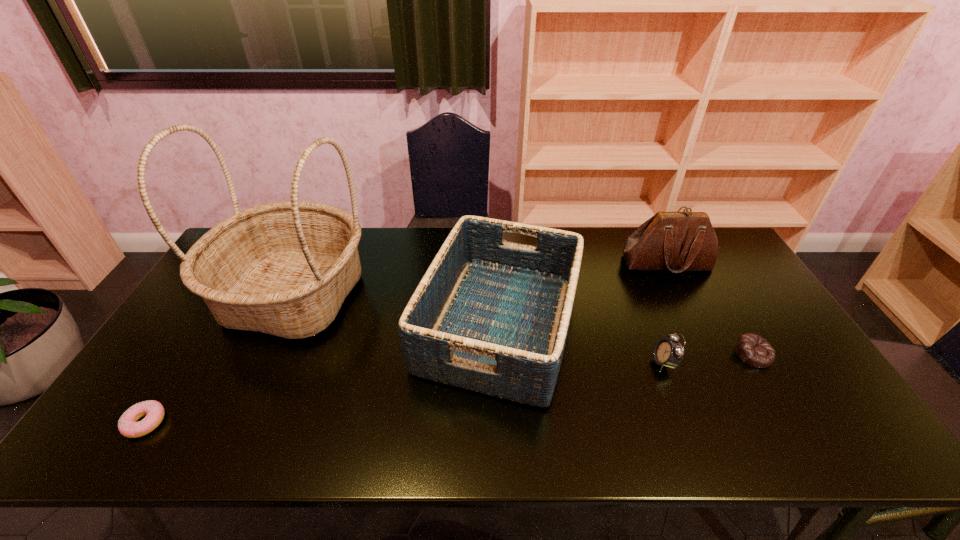
This screenshot has height=540, width=960. Find the location of `the taller basket`. the taller basket is located at coordinates (284, 268).

The width and height of the screenshot is (960, 540). I want to click on the tallest object, so (x=284, y=268).

Where is `shoulder bag`? The width and height of the screenshot is (960, 540). shoulder bag is located at coordinates (677, 241).

Identify the location of the third object from left to right. (491, 316).

Identify the location of the right basket. (491, 316).

Find the location of a particular element. The width and height of the screenshot is (960, 540). the fourth tallest object is located at coordinates (669, 353).

Find the location of a particular element. The width and height of the screenshot is (960, 540). the fifth tallest object is located at coordinates (752, 349).

Identify the location of doughnut. (128, 426).

Identify the location of vacant space located 0.070m on the back of the taller basket. The height and width of the screenshot is (540, 960). (321, 238).

Where is `vacant space located 0.260m on the left of the shoulder bag`? vacant space located 0.260m on the left of the shoulder bag is located at coordinates (543, 263).